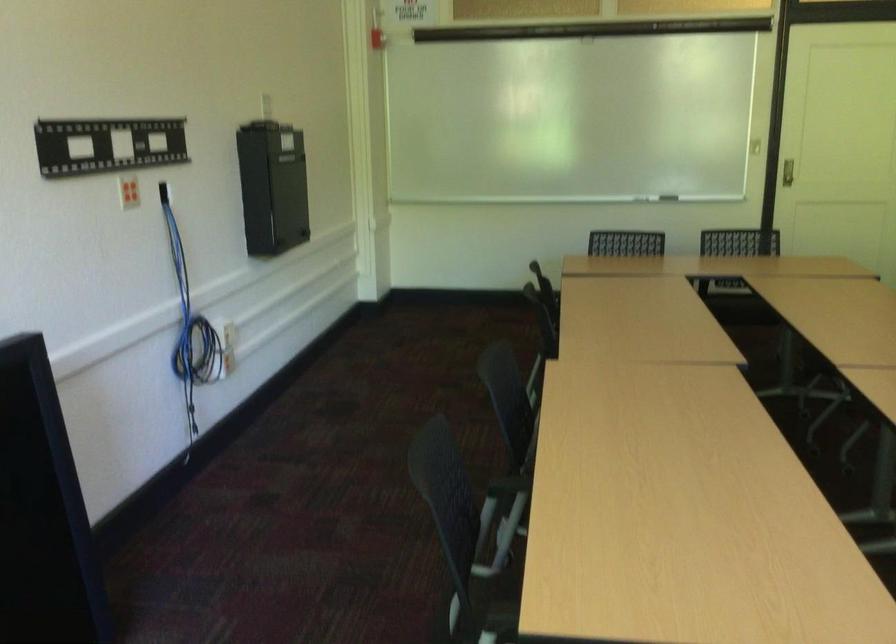
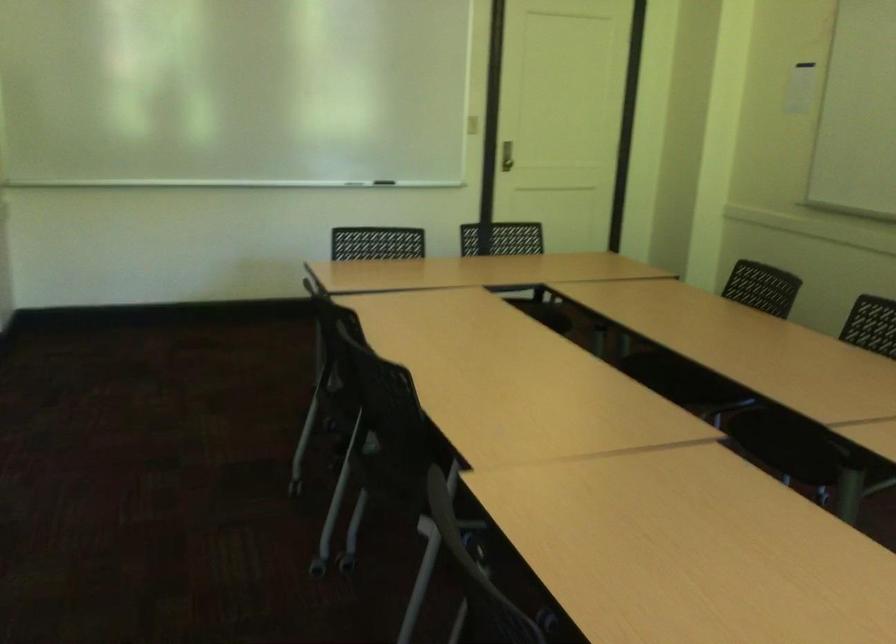
Question: I am providing you with two images of the same scene from different viewpoints. Please identify which objects are invisible in image2.

Choices:
 (A) metal door handle
 (B) wide silver handle
 (C) recessed door handle
 (D) chair sitting surface

Answer: (C)